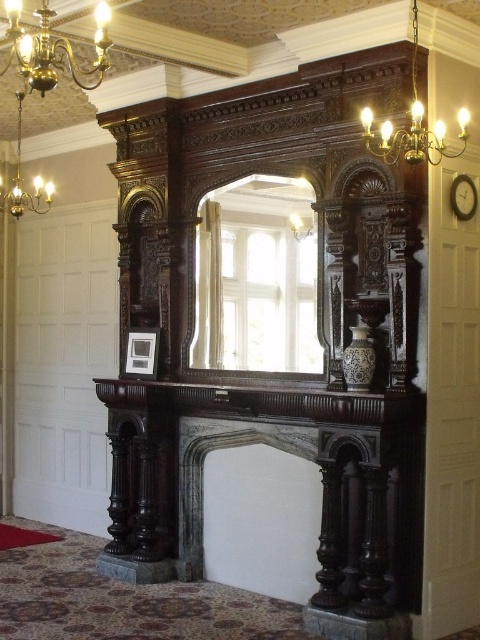
You are standing in the formal room and want to hang a picture frame between the dark wood mantle at center and the gold brass chandelier at upper left. Can you place it directly in the middle between them?

The dark wood mantle at center is below the gold brass chandelier at upper left, so placing a picture frame directly in the middle between them would require positioning it halfway along the vertical line connecting the two objects.